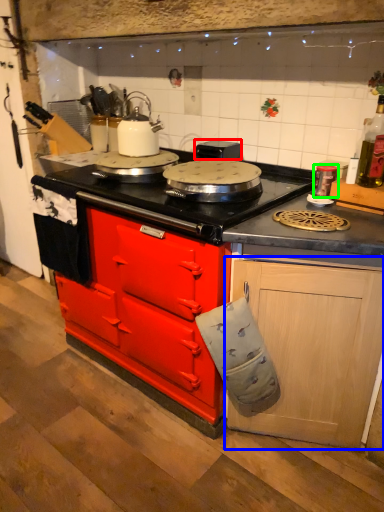
Question: Which is farther away from appliance (highlighted by a red box)? cabinetry (highlighted by a blue box) or kitchen appliance (highlighted by a green box)?

Choices:
 (A) cabinetry
 (B) kitchen appliance

Answer: (A)